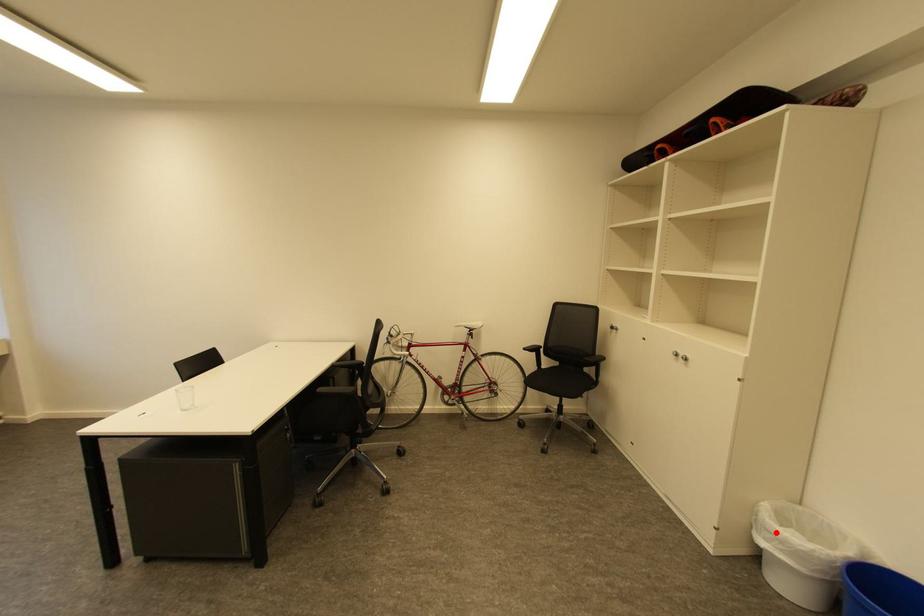
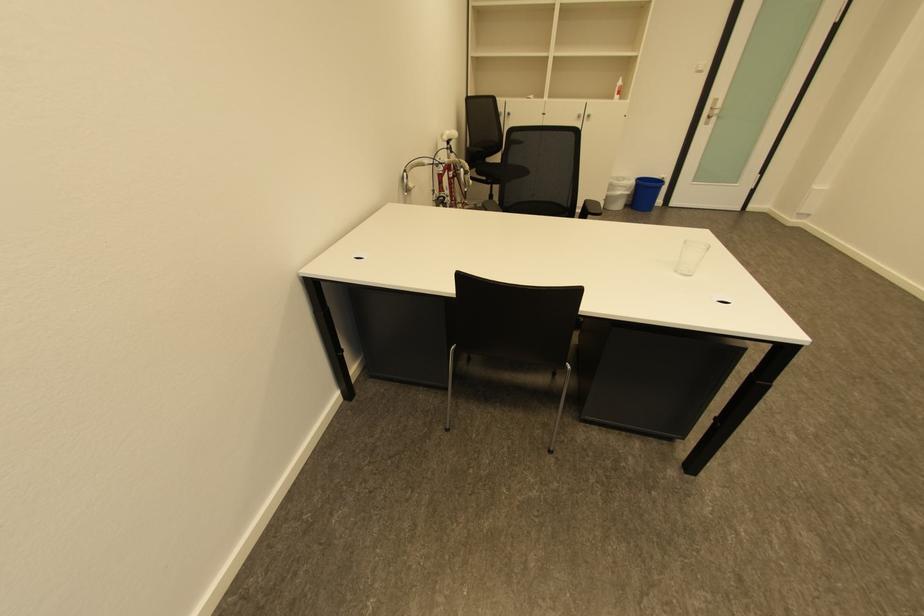
In the second image, find the point that corresponds to the highlighted location in the first image.

(626, 188)